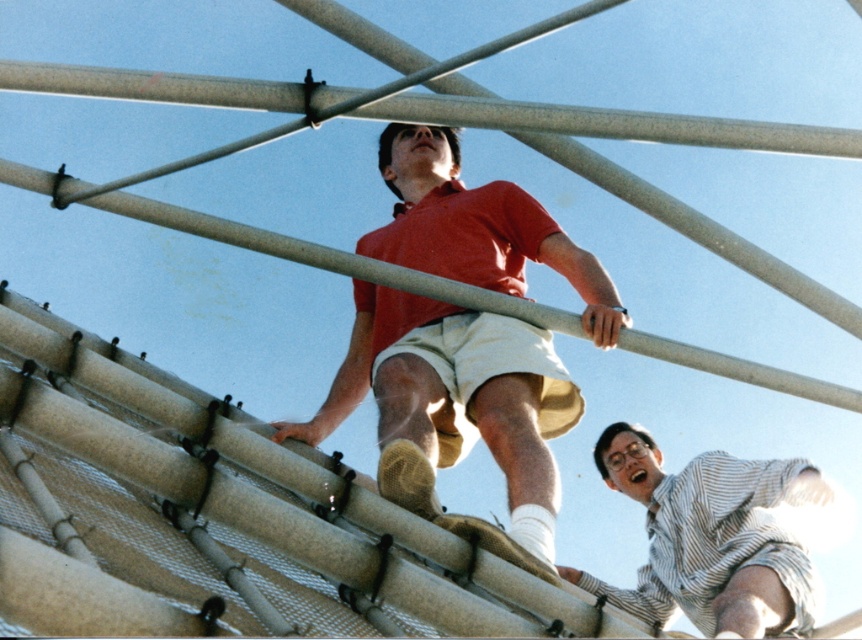
You are a photographer trying to capture both the matte red shirt at upper center and the striped cotton shirt at upper right in a single frame. Based on their sizes, which one might appear closer to the camera?

The matte red shirt at upper center is bigger than the striped cotton shirt at upper right, so it might appear closer to the camera since larger objects in a frame typically indicate proximity to the viewer.

You are a safety inspector assessing the safety of the structure shown. The safety guidelines require that any two people on the structure must be at least 6 meters apart for safety. Based on the image, are the matte red shirt at upper center and striped cotton shirt at upper right violating the safety guidelines?

The distance between the matte red shirt at upper center and the striped cotton shirt at upper right is 5.72 meters, which is less than the required 6 meters. Therefore, they are violating the safety guidelines.